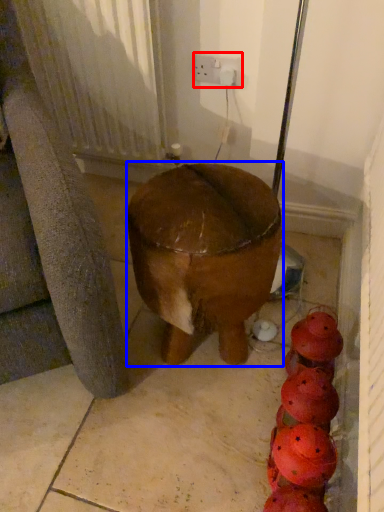
Question: Which object is closer to the camera taking this photo, electric outlet (highlighted by a red box) or furniture (highlighted by a blue box)?

Choices:
 (A) electric outlet
 (B) furniture

Answer: (B)